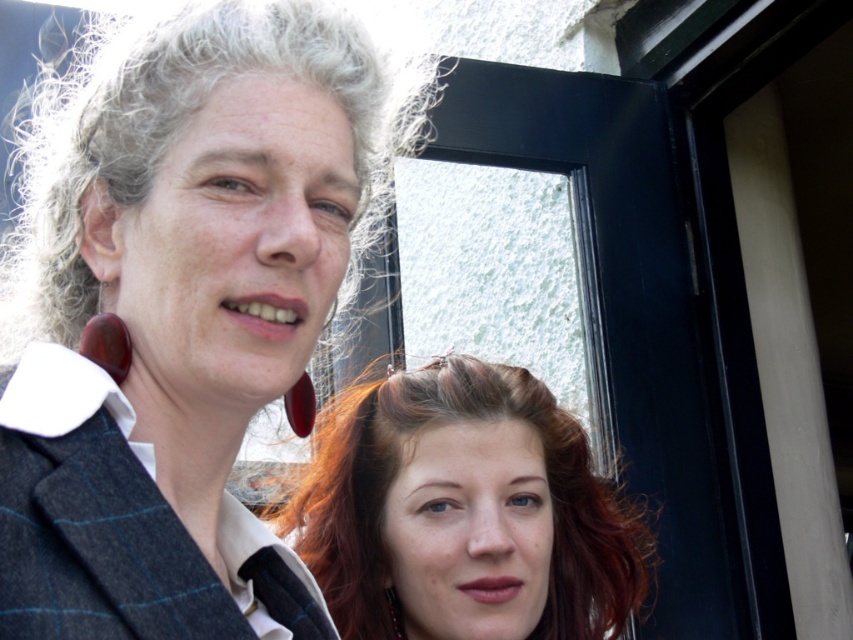
Question: Can you confirm if shiny brown hair at center is positioned to the right of gray curly hair at upper left?

Choices:
 (A) no
 (B) yes

Answer: (B)

Question: Does shiny brown hair at center appear under gray curly hair at upper left?

Choices:
 (A) yes
 (B) no

Answer: (A)

Question: Which object appears closest to the camera in this image?

Choices:
 (A) shiny brown hair at center
 (B) gray curly hair at upper left

Answer: (B)

Question: Which point is farther from the camera taking this photo?

Choices:
 (A) (421, 484)
 (B) (276, 3)

Answer: (A)

Question: Which object is closer to the camera taking this photo?

Choices:
 (A) gray curly hair at upper left
 (B) shiny brown hair at center

Answer: (A)

Question: Does shiny brown hair at center have a smaller size compared to gray curly hair at upper left?

Choices:
 (A) no
 (B) yes

Answer: (B)